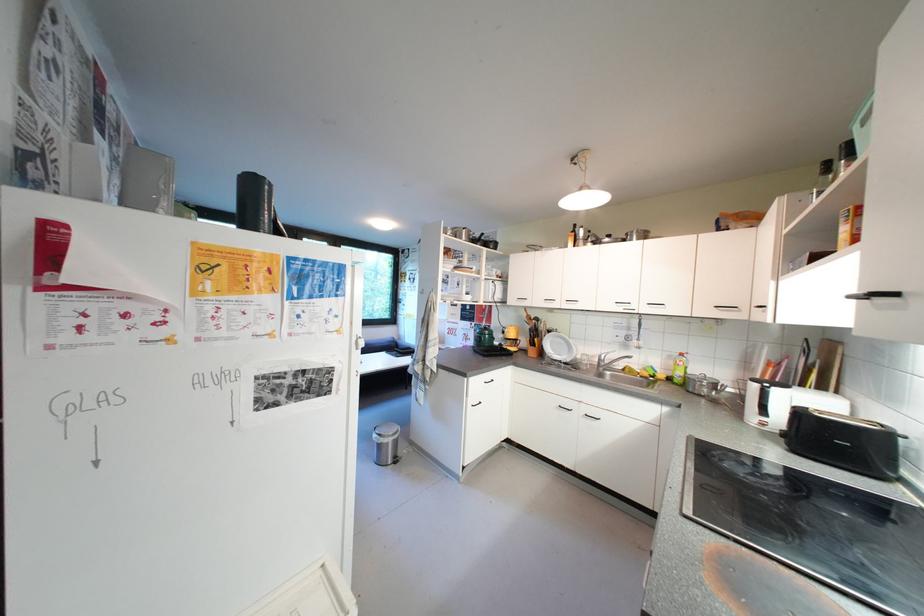
Where is `faucet handle`? Image resolution: width=924 pixels, height=616 pixels. faucet handle is located at coordinates (604, 354).